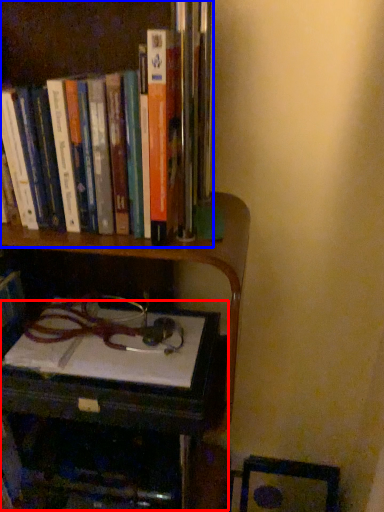
Question: Which object is further to the camera taking this photo, table (highlighted by a red box) or book (highlighted by a blue box)?

Choices:
 (A) table
 (B) book

Answer: (A)